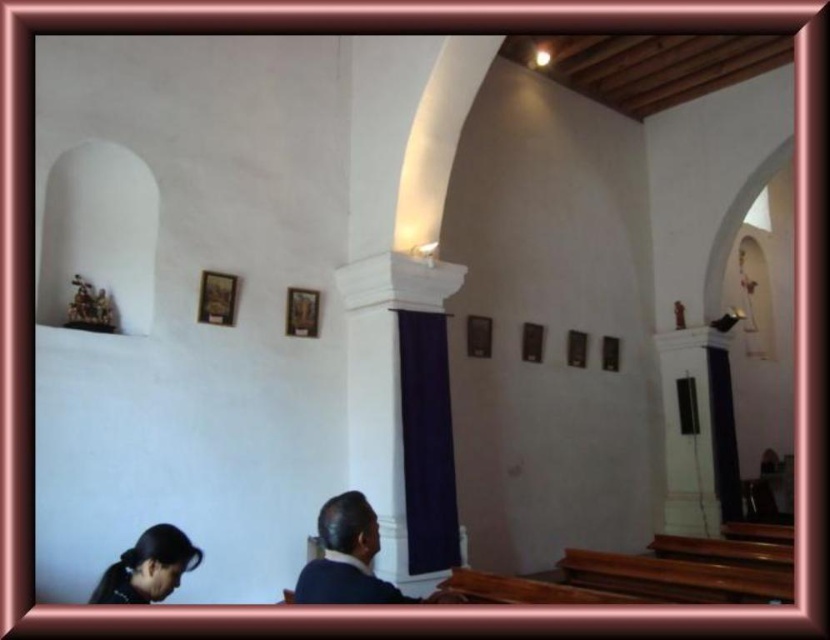
Which is above, dark blue suit at center or matte black frame at center?

Positioned higher is matte black frame at center.

Between dark blue suit at center and matte black frame at center, which one appears on the left side from the viewer's perspective?

From the viewer's perspective, dark blue suit at center appears more on the left side.

This screenshot has width=830, height=640. What do you see at coordinates (345, 557) in the screenshot?
I see `dark blue suit at center` at bounding box center [345, 557].

Locate an element on the screen. dark blue suit at center is located at coordinates (345, 557).

Is dark blue suit at center above wooden frame at upper center?

No, dark blue suit at center is not above wooden frame at upper center.

Who is more distant from viewer, [334,598] or [226,308]?

The point [226,308] is more distant.

The image size is (830, 640). Identify the location of dark blue suit at center. (345, 557).

Where is `dark blue suit at center`? The height and width of the screenshot is (640, 830). dark blue suit at center is located at coordinates (345, 557).

In the scene shown: Is wooden frame at center shorter than matte black frame at center?

Yes, wooden frame at center is shorter than matte black frame at center.

From the picture: Is wooden frame at center to the left of matte black frame at center from the viewer's perspective?

Indeed, wooden frame at center is positioned on the left side of matte black frame at center.

Does point (310, 324) come closer to viewer compared to point (491, 324)?

Yes, point (310, 324) is closer to viewer.

At what (x,y) coordinates should I click in order to perform the action: click on wooden frame at center. Please return your answer as a coordinate pair (x, y). This screenshot has width=830, height=640. Looking at the image, I should click on (301, 310).